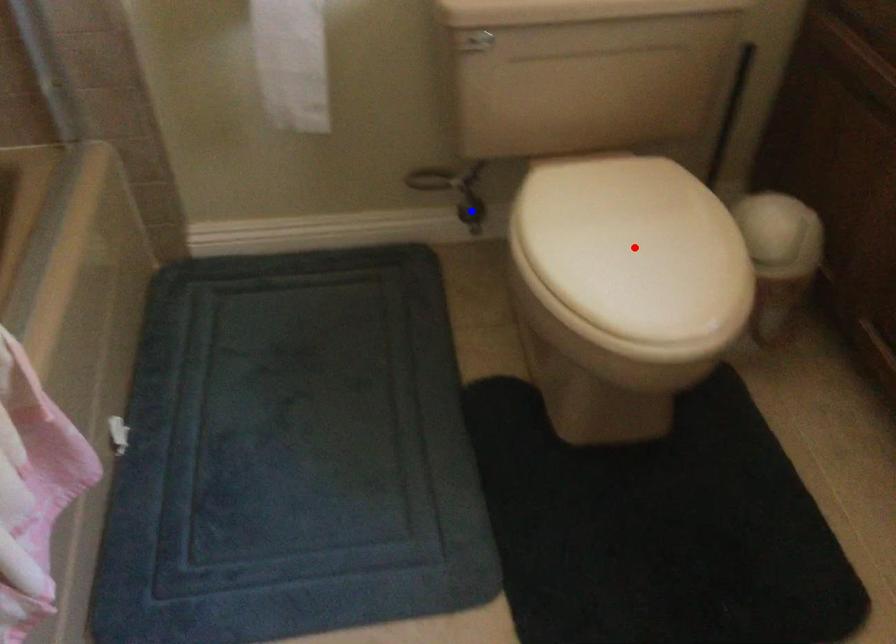
Question: Two points are marked on the image. Which point is closer to the camera?

Choices:
 (A) Blue point is closer.
 (B) Red point is closer.

Answer: (B)